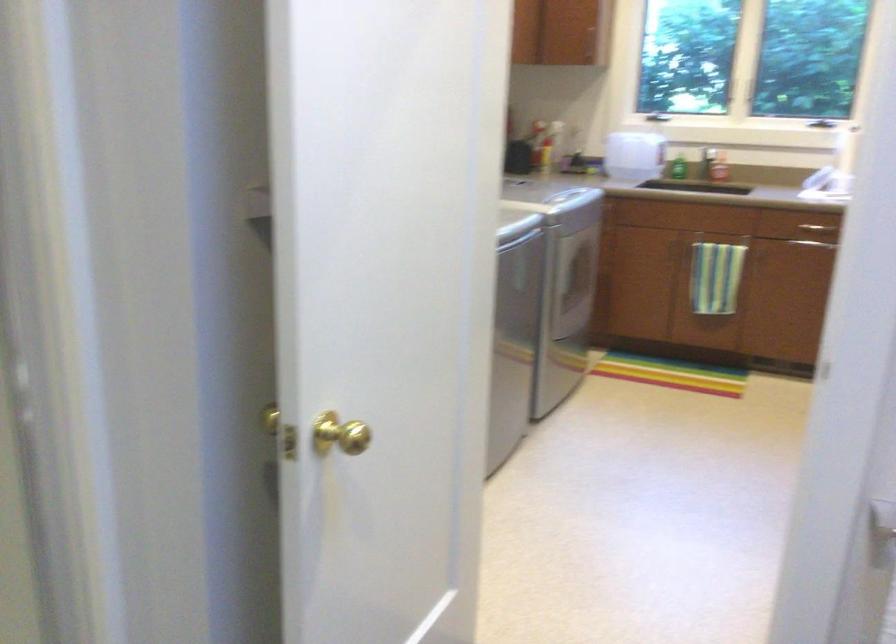
Where is `towel rack handle`? towel rack handle is located at coordinates (815, 243).